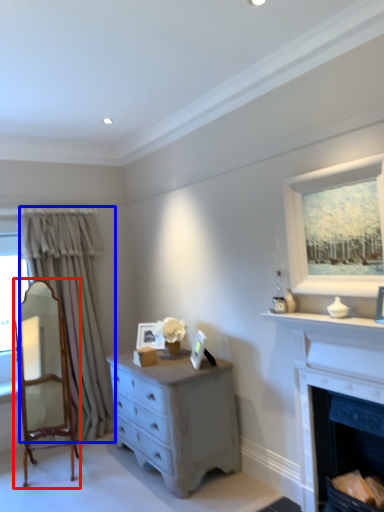
Question: Which of the following is the farthest to the observer, armchair (highlighted by a red box) or curtain (highlighted by a blue box)?

Choices:
 (A) armchair
 (B) curtain

Answer: (B)